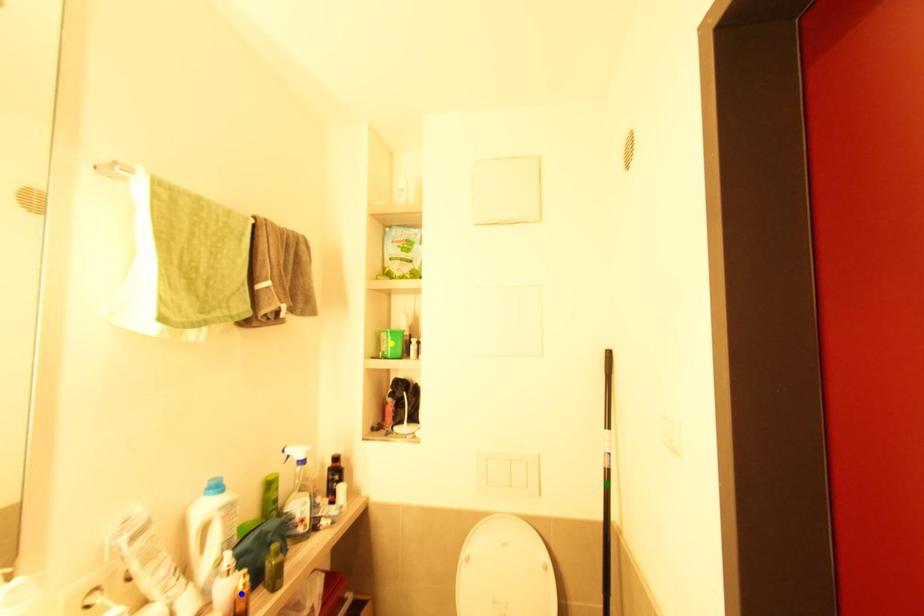
Order these from nearest to farthest:
- yellow point
- green point
- blue point

1. blue point
2. green point
3. yellow point